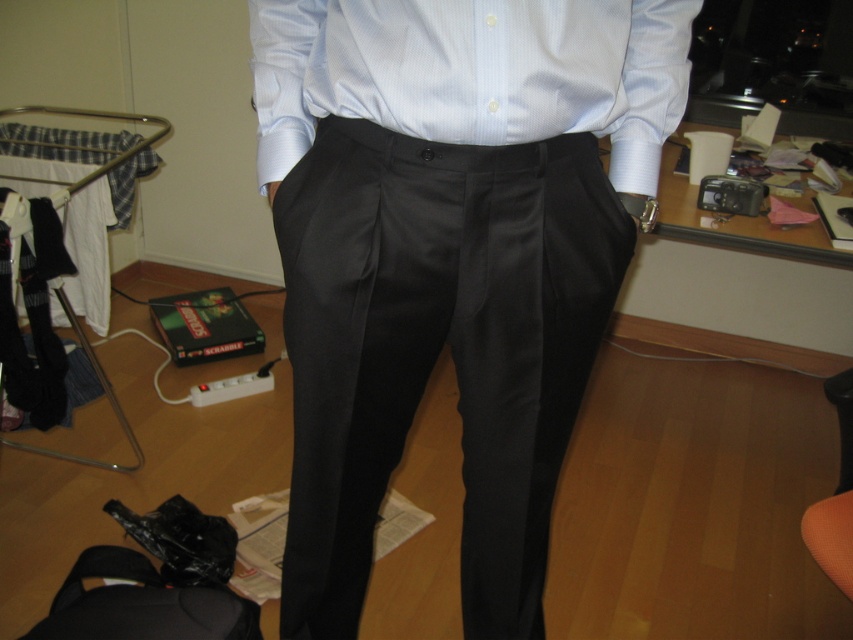
Image resolution: width=853 pixels, height=640 pixels. I want to click on satin black trousers at center, so click(450, 257).

What do you see at coordinates (450, 257) in the screenshot? I see `satin black trousers at center` at bounding box center [450, 257].

Identify the location of satin black trousers at center. pos(450,257).